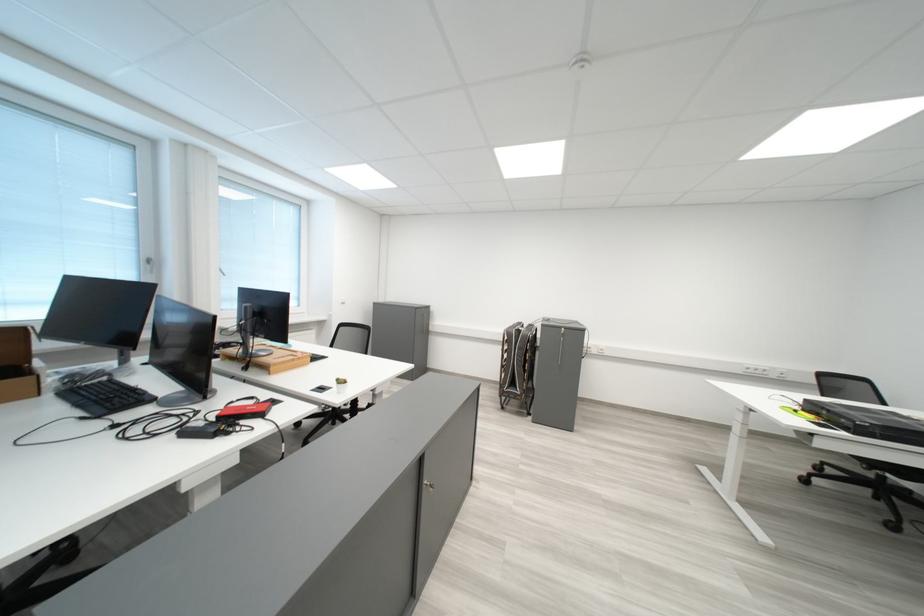
Find the location of a particular element. Image resolution: width=924 pixels, height=616 pixels. cabinet door handle is located at coordinates (429, 485).